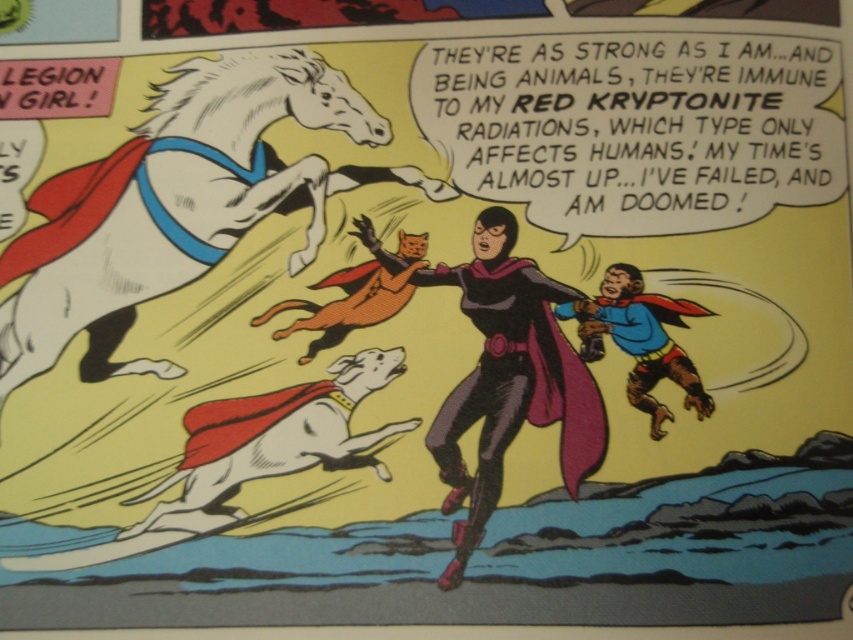
Can you confirm if black glossy cape at center is positioned below blue fabric cape at lower right?

Correct, black glossy cape at center is located below blue fabric cape at lower right.

Does point (569, 346) come behind point (672, 316)?

No, it is not.

Identify the location of black glossy cape at center. pyautogui.click(x=509, y=380).

Who is taller, white glossy horse at upper left or black glossy cape at center?

With more height is black glossy cape at center.

Between white glossy horse at upper left and black glossy cape at center, which one is positioned lower?

black glossy cape at center is lower down.

Is point (154, 176) positioned after point (399, 262)?

Yes.

Where is `white glossy horse at upper left`? The image size is (853, 640). white glossy horse at upper left is located at coordinates (169, 205).

Looking at this image, can you confirm if white glossy horse at upper left is taller than blue fabric cape at lower right?

Yes, white glossy horse at upper left is taller than blue fabric cape at lower right.

Which is behind, point (155, 154) or point (698, 384)?

Point (155, 154)

Does point (289, 205) lie in front of point (628, 278)?

No, (289, 205) is behind (628, 278).

Where is `white glossy horse at upper left`? white glossy horse at upper left is located at coordinates (169, 205).